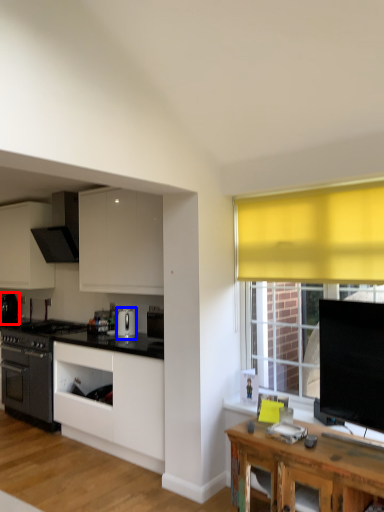
Question: Which object appears farthest to the camera in this image, kitchen appliance (highlighted by a red box) or kitchen appliance (highlighted by a blue box)?

Choices:
 (A) kitchen appliance
 (B) kitchen appliance

Answer: (A)